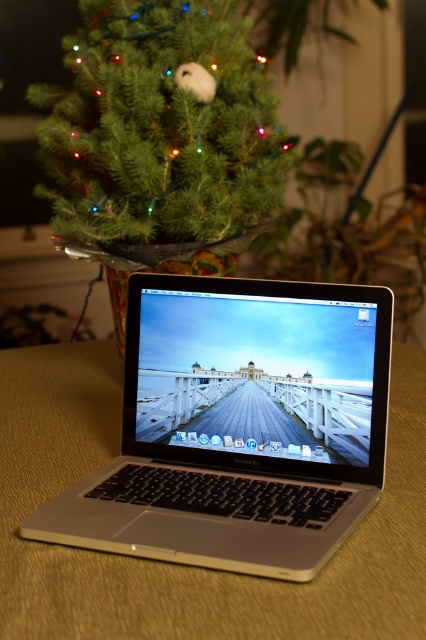
Question: Can you confirm if silver metallic laptop at center is wider than green matte christmas tree at upper left?

Choices:
 (A) yes
 (B) no

Answer: (B)

Question: Can you confirm if silver metallic laptop at center is bigger than green matte christmas tree at upper left?

Choices:
 (A) yes
 (B) no

Answer: (B)

Question: Can you confirm if silver metallic laptop at center is bigger than green matte christmas tree at upper left?

Choices:
 (A) no
 (B) yes

Answer: (A)

Question: Which point is farther from the camera taking this photo?

Choices:
 (A) (350, 515)
 (B) (238, 24)

Answer: (B)

Question: Among these points, which one is farthest from the camera?

Choices:
 (A) (325, 554)
 (B) (192, 113)

Answer: (B)